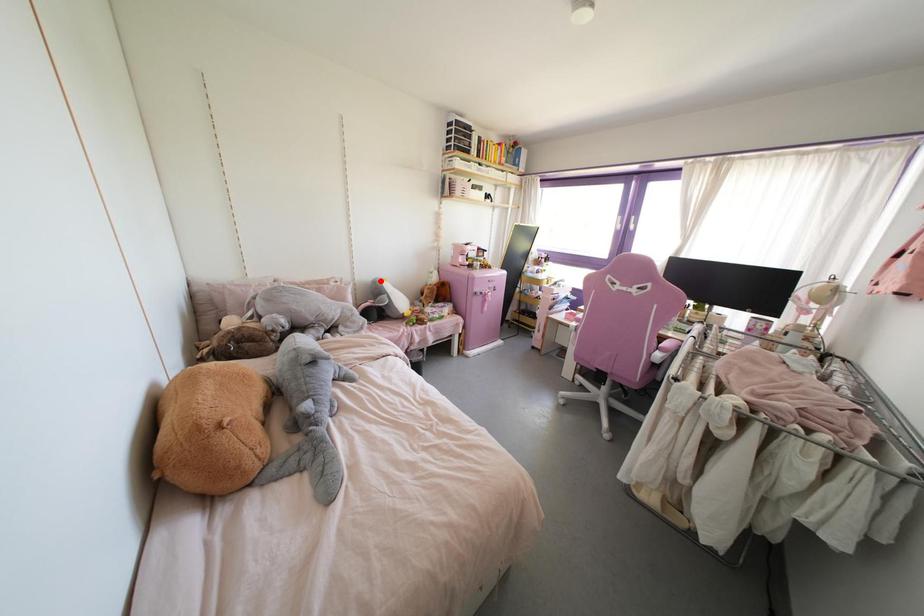
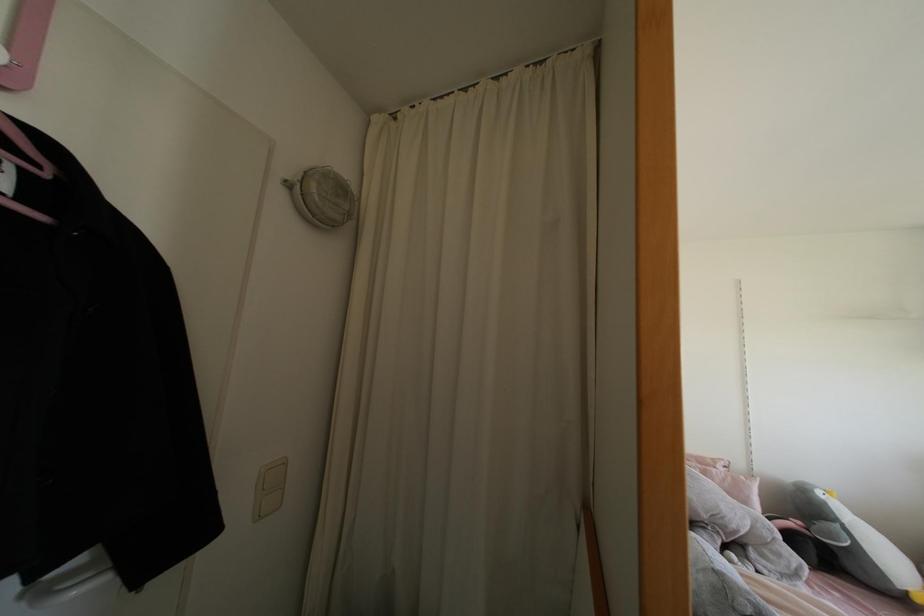
Where in the second image is the point corresponding to the highlighted location from the first image?

(819, 493)